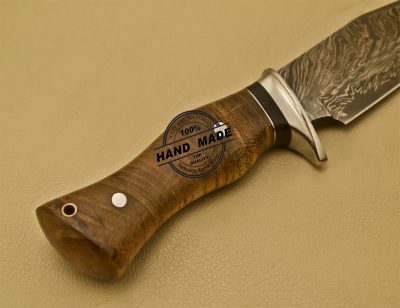
Identify the location of knife's bolster. This screenshot has height=308, width=400. (294, 109).